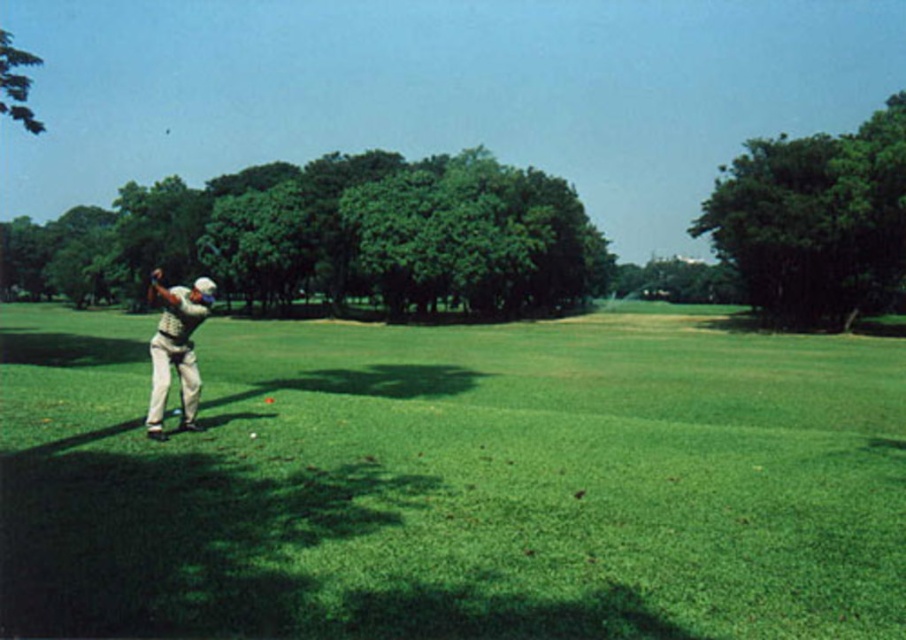
Question: Is green grass at left to the right of white cotton shirt at left from the viewer's perspective?

Choices:
 (A) yes
 (B) no

Answer: (A)

Question: Does green grass at left appear on the right side of white cotton shirt at left?

Choices:
 (A) yes
 (B) no

Answer: (A)

Question: Is green grass at left positioned behind white cotton shirt at left?

Choices:
 (A) yes
 (B) no

Answer: (B)